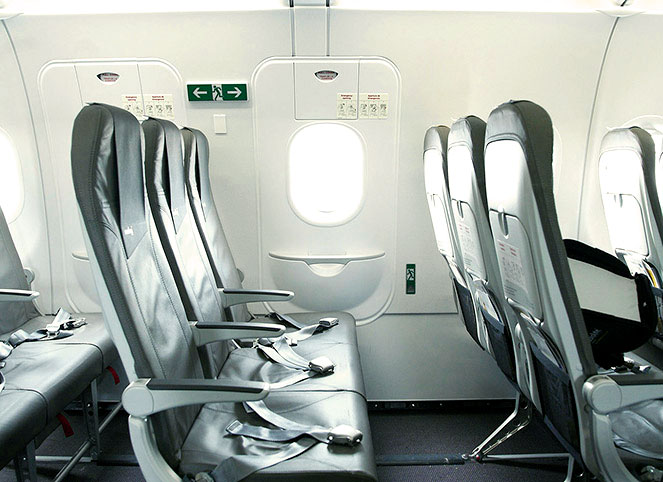
Find the location of `seats`. seats is located at coordinates (20, 401), (78, 328), (52, 366), (325, 422), (335, 371), (339, 323), (546, 294), (469, 256), (432, 225), (640, 224).